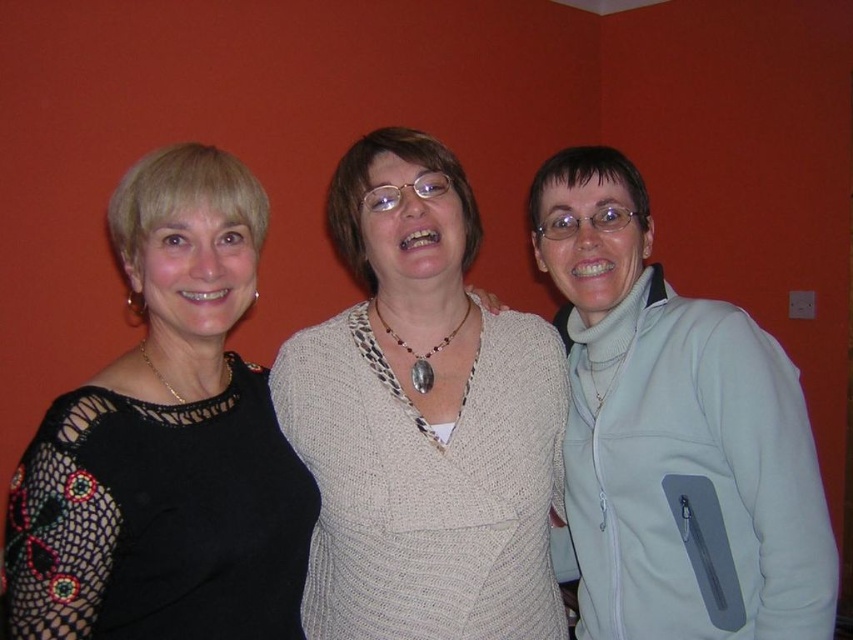
Question: Based on their relative distances, which object is farther from the white knitted sweater at center?

Choices:
 (A) black lace dress at left
 (B) light blue fleece jacket at right

Answer: (B)

Question: Is black lace dress at left to the right of light blue fleece jacket at right from the viewer's perspective?

Choices:
 (A) no
 (B) yes

Answer: (A)

Question: Does white knitted sweater at center appear under black lace dress at left?

Choices:
 (A) yes
 (B) no

Answer: (A)

Question: Considering the real-world distances, which object is closest to the white knitted sweater at center?

Choices:
 (A) light blue fleece jacket at right
 (B) black lace dress at left

Answer: (B)

Question: Considering the relative positions of black lace dress at left and light blue fleece jacket at right in the image provided, where is black lace dress at left located with respect to light blue fleece jacket at right?

Choices:
 (A) below
 (B) above

Answer: (B)

Question: Among these points, which one is farthest from the camera?

Choices:
 (A) (801, 589)
 (B) (192, 387)
 (C) (476, 550)

Answer: (B)